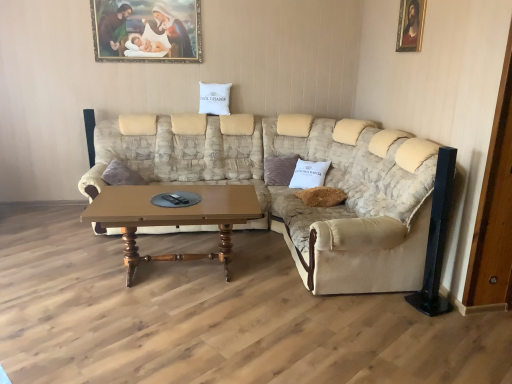
Question: Is velvet brown pillow at center, which is counted as the second pillow, starting from the left, in front of or behind beige fabric couch at center in the image?

Choices:
 (A) front
 (B) behind

Answer: (B)

Question: Is velvet brown pillow at center, the 1th pillow positioned from the right, to the left or to the right of beige fabric couch at center in the image?

Choices:
 (A) right
 (B) left

Answer: (A)

Question: Estimate the real-world distances between objects in this image. Which object is closer to the velvet brown pillow at center, positioned as the second pillow in top-to-bottom order?

Choices:
 (A) wooden framed painting at upper center, placed as the 2th picture frame when sorted from front to back
 (B) wooden framed portrait at upper right, the first picture frame positioned from the right
 (C) beige fabric couch at center
 (D) beige fabric couch at right
 (E) white fabric pillow at upper center, positioned as the 2th pillow in right-to-left order

Answer: (C)

Question: Considering the real-world distances, which object is farthest from the beige fabric couch at center?

Choices:
 (A) wooden polished coffee table at center
 (B) wooden framed painting at upper center, which is the 1th picture frame from back to front
 (C) velvet brown pillow at center, which is counted as the second pillow, starting from the left
 (D) wooden framed portrait at upper right, the first picture frame positioned from the right
 (E) white fabric pillow at upper center, positioned as the 2th pillow in right-to-left order

Answer: (D)